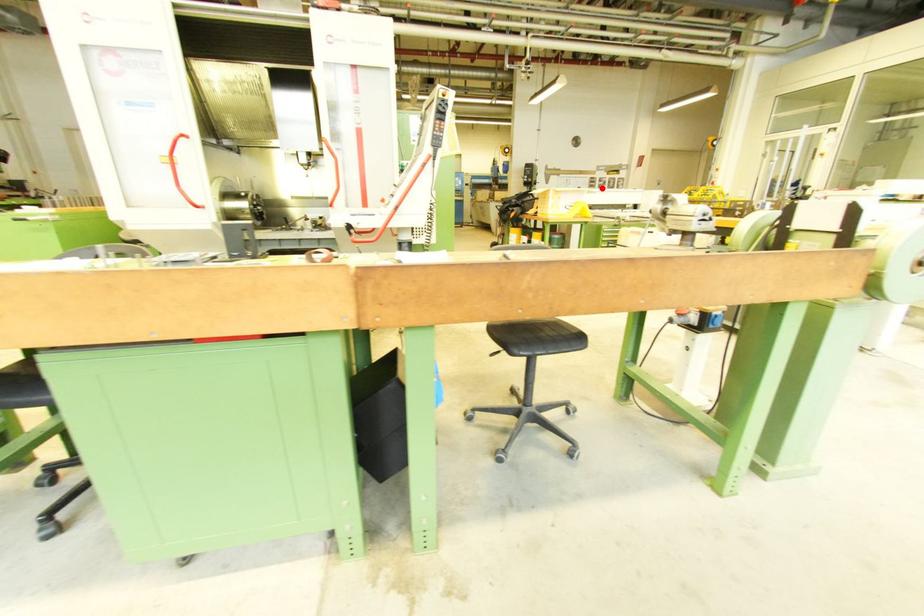
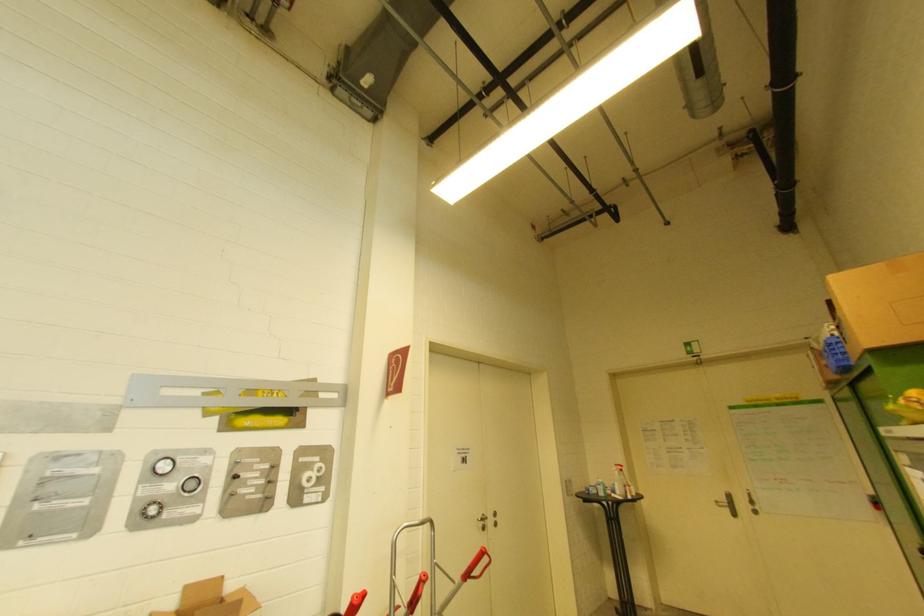
Question: I am providing you with two images of the same scene from different viewpoints. A red point is shown in image1. For the corresponding object point in image2, is it positioned nearer or farther from the camera?

Choices:
 (A) Nearer
 (B) Farther

Answer: (B)